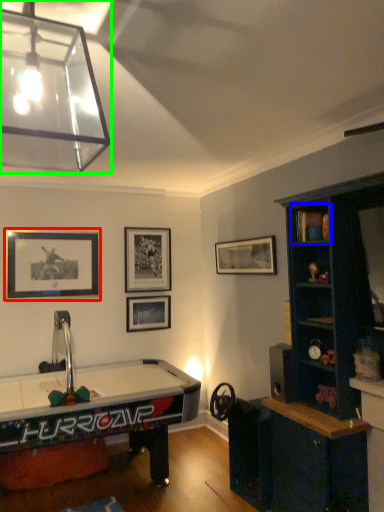
Question: Considering the real-world distances, which object is closest to picture frame (highlighted by a red box)? cabinet (highlighted by a blue box) or lamp (highlighted by a green box).

Choices:
 (A) cabinet
 (B) lamp

Answer: (B)